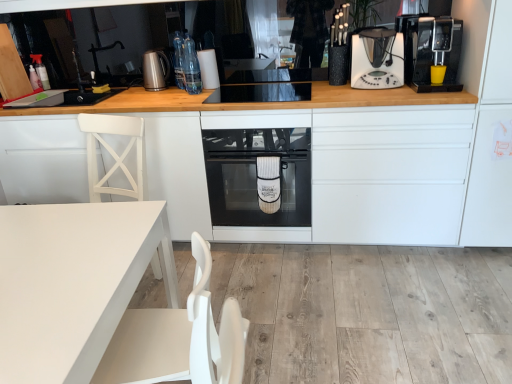
Question: In terms of size, does brushed metal kettle at upper center, which is the first kitchen appliance from left to right, appear bigger or smaller than black plastic coffee machine at upper right, the 1th kitchen appliance viewed from the right?

Choices:
 (A) big
 (B) small

Answer: (B)

Question: Is point (153, 54) positioned closer to the camera than point (417, 26)?

Choices:
 (A) closer
 (B) farther

Answer: (B)

Question: Which object is the farthest from the white plastic coffee maker at upper right, which appears as the 2th kitchen appliance when viewed from the left?

Choices:
 (A) black glass oven at center
 (B) white matte table at lower left
 (C) translucent plastic spray bottle at upper left, acting as the 1th bottle starting from the back
 (D) clear glass bottles at upper center, the second bottle viewed from the left
 (E) black plastic coffee machine at upper right, positioned as the 3th kitchen appliance in left-to-right order

Answer: (C)

Question: Estimate the real-world distances between objects in this image. Which object is closer to the white matte table at lower left?

Choices:
 (A) clear glass bottles at upper center, placed as the 2th bottle when sorted from back to front
 (B) translucent plastic spray bottle at upper left, which is the first bottle from left to right
 (C) black plastic coffee machine at right
 (D) white matte cabinet at center, which ranks as the second cabinetry in left-to-right order
 (E) black glass oven at center

Answer: (D)